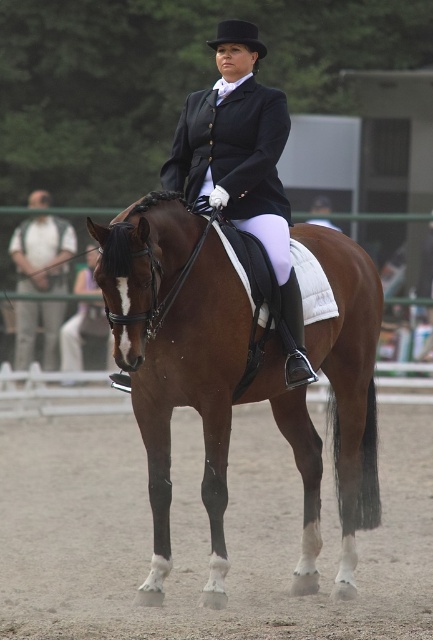
Does brown glossy horse at center have a larger size compared to matte black jacket at upper center?

Yes.

What do you see at coordinates (175, 355) in the screenshot?
I see `brown glossy horse at center` at bounding box center [175, 355].

This screenshot has height=640, width=433. Identify the location of brown glossy horse at center. (175, 355).

Can you confirm if brown sandy dirt at center is wider than brown glossy horse at center?

No, brown sandy dirt at center is not wider than brown glossy horse at center.

Is brown sandy dirt at center above brown glossy horse at center?

Incorrect, brown sandy dirt at center is not positioned above brown glossy horse at center.

Identify the location of brown sandy dirt at center. (203, 532).

I want to click on brown sandy dirt at center, so click(203, 532).

Between black glossy riding jacket at center and matte black jacket at upper center, which one has more height?

Standing taller between the two is black glossy riding jacket at center.

Is point (203, 102) in front of point (45, 195)?

That is True.

Where is `black glossy riding jacket at center`? The height and width of the screenshot is (640, 433). black glossy riding jacket at center is located at coordinates (242, 168).